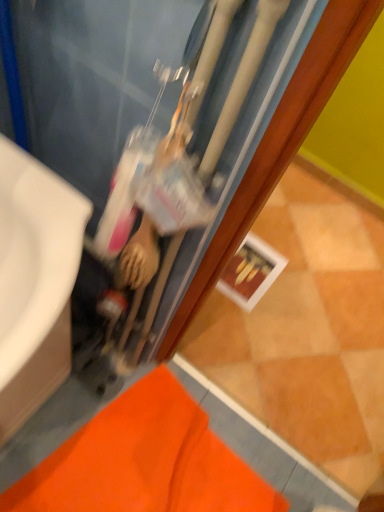
Question: Considering the relative sizes of matte black water heater at center and orange fabric bath mat at lower left in the image provided, is matte black water heater at center taller than orange fabric bath mat at lower left?

Choices:
 (A) no
 (B) yes

Answer: (B)

Question: Is matte black water heater at center closer to the viewer compared to orange fabric bath mat at lower left?

Choices:
 (A) yes
 (B) no

Answer: (A)

Question: From a real-world perspective, is matte black water heater at center physically below orange fabric bath mat at lower left?

Choices:
 (A) yes
 (B) no

Answer: (B)

Question: Is matte black water heater at center positioned far away from orange fabric bath mat at lower left?

Choices:
 (A) no
 (B) yes

Answer: (A)

Question: Is matte black water heater at center facing away from orange fabric bath mat at lower left?

Choices:
 (A) no
 (B) yes

Answer: (A)

Question: Visually, is matte black water heater at center positioned to the left or to the right of white glossy sink at left?

Choices:
 (A) right
 (B) left

Answer: (A)

Question: Choose the correct answer: Is matte black water heater at center inside white glossy sink at left or outside it?

Choices:
 (A) outside
 (B) inside

Answer: (A)

Question: Considering the positions of matte black water heater at center and white glossy sink at left in the image, is matte black water heater at center wider or thinner than white glossy sink at left?

Choices:
 (A) wide
 (B) thin

Answer: (B)

Question: From their relative heights in the image, would you say matte black water heater at center is taller or shorter than white glossy sink at left?

Choices:
 (A) tall
 (B) short

Answer: (A)

Question: Considering the relative positions of white glossy sink at left and orange fabric bath mat at lower left in the image provided, is white glossy sink at left to the left or to the right of orange fabric bath mat at lower left?

Choices:
 (A) right
 (B) left

Answer: (B)

Question: Considering the positions of white glossy sink at left and orange fabric bath mat at lower left in the image, is white glossy sink at left wider or thinner than orange fabric bath mat at lower left?

Choices:
 (A) thin
 (B) wide

Answer: (A)

Question: From a real-world perspective, is white glossy sink at left positioned above or below orange fabric bath mat at lower left?

Choices:
 (A) above
 (B) below

Answer: (A)

Question: Is point (56, 287) positioned closer to the camera than point (137, 401)?

Choices:
 (A) farther
 (B) closer

Answer: (B)

Question: In terms of width, does white glossy sink at left look wider or thinner when compared to matte black water heater at center?

Choices:
 (A) thin
 (B) wide

Answer: (B)

Question: Considering the positions of white glossy sink at left and matte black water heater at center in the image, is white glossy sink at left taller or shorter than matte black water heater at center?

Choices:
 (A) short
 (B) tall

Answer: (A)